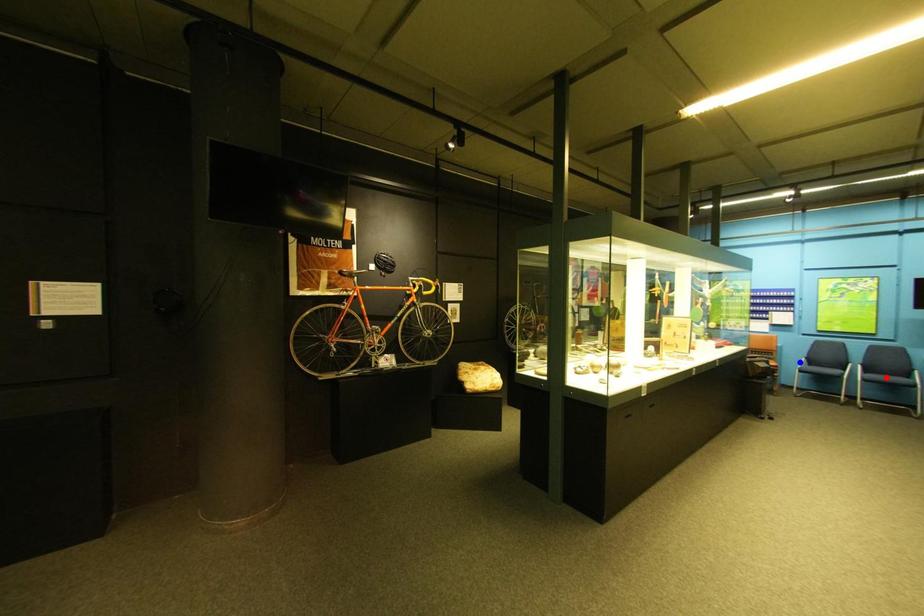
Question: Which of the two points in the image is closer to the camera?

Choices:
 (A) Blue point is closer.
 (B) Red point is closer.

Answer: (B)